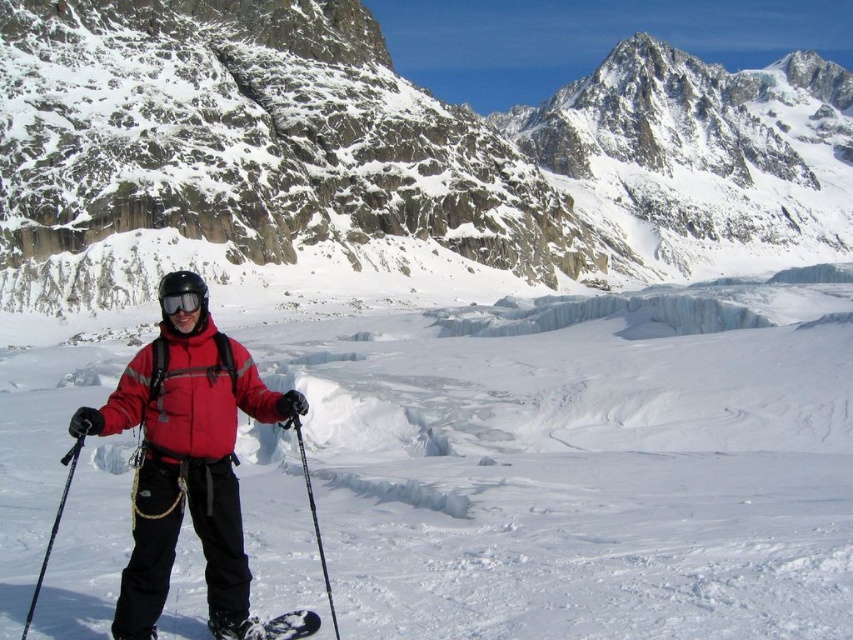
In the scene shown: You are a mountaineer planning to place a safety marker at point (184, 458). What object is located at this coordinate?

The point (184, 458) corresponds to the red matte jacket at center.

You are a mountain rescue team member who needs to locate a missing skier. You have a drone with a camera that has a 10 feet zoom range. The drone is currently hovering above the red matte jacket at center. Can the drone see the black plastic ski pole at left with its current zoom setting?

The red matte jacket at center and black plastic ski pole at left are 17.52 feet apart from each other. Since the drone has a 10 feet zoom range, it cannot see the black plastic ski pole at left as the distance exceeds the zoom capability.